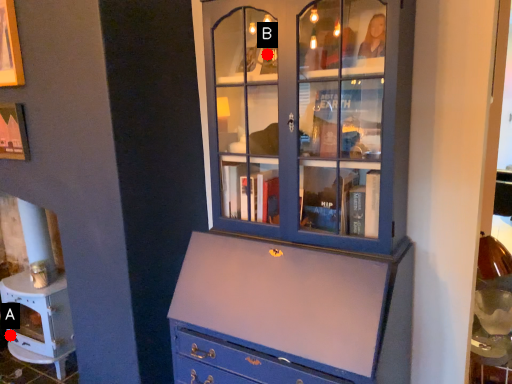
Question: Two points are circled on the image, labeled by A and B beside each circle. Which of the following is the closest to the observer?

Choices:
 (A) A is closer
 (B) B is closer

Answer: (B)